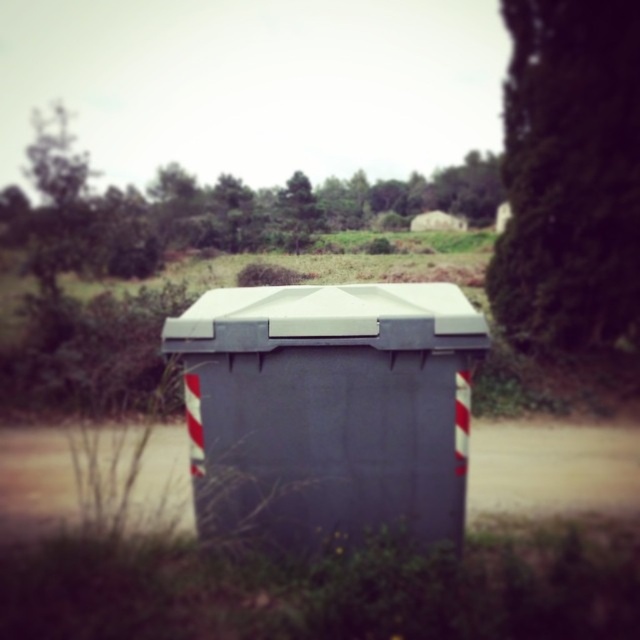
You are a delivery person trying to determine if the gray matte container at center can be seen from the road without obstruction. Considering the green leafy tree at upper center, is the container visible above the tree?

The gray matte container at center is not as tall as the green leafy tree at upper center, so it would be obscured by the tree and not visible from above.

You are a delivery person who needs to place a package on the gray matte container at center. However, there is a green leafy tree at upper center nearby. Can you safely place the package on the container without the tree obstructing your view of the container?

The gray matte container at center is closer to the viewer than the green leafy tree at upper center, so you can safely place the package on the container without the tree obstructing your view.

You are a delivery person who needs to place a package on the gray matte container at center. However, there is a green leafy tree at upper right nearby. Can you place the package on the container without the tree blocking your access?

The gray matte container at center has a larger size compared to green leafy tree at upper right, so yes, you can place the package on the gray matte container at center without the tree blocking your access because the container is bigger and likely provides enough space.